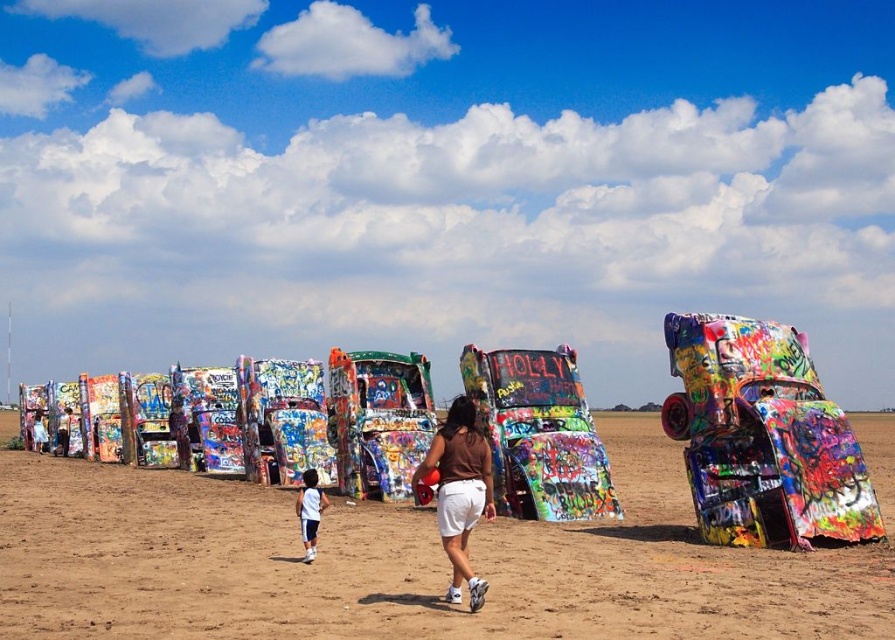
Looking at this image, who is positioned more to the left, brown fabric shorts at center or white cotton shorts at lower center?

From the viewer's perspective, white cotton shorts at lower center appears more on the left side.

Can you confirm if brown fabric shorts at center is thinner than white cotton shorts at lower center?

Yes, brown fabric shorts at center is thinner than white cotton shorts at lower center.

Who is more distant from viewer, (483, 490) or (307, 486)?

Positioned behind is point (307, 486).

Find the location of a particular element. The image size is (895, 640). brown fabric shorts at center is located at coordinates (459, 492).

Does brown sandy dirt field at center have a smaller size compared to white cotton shorts at lower center?

Actually, brown sandy dirt field at center might be larger than white cotton shorts at lower center.

Is brown sandy dirt field at center in front of white cotton shorts at lower center?

That is True.

Is point (616, 586) closer to camera compared to point (311, 538)?

Yes.

Where is `brown sandy dirt field at center`? This screenshot has height=640, width=895. brown sandy dirt field at center is located at coordinates (413, 561).

Is brown sandy dirt field at center bigger than brown fabric shorts at center?

Yes.

Can you confirm if brown sandy dirt field at center is thinner than brown fabric shorts at center?

In fact, brown sandy dirt field at center might be wider than brown fabric shorts at center.

Image resolution: width=895 pixels, height=640 pixels. What do you see at coordinates (413, 561) in the screenshot?
I see `brown sandy dirt field at center` at bounding box center [413, 561].

What are the coordinates of `brown sandy dirt field at center` in the screenshot? It's located at (413, 561).